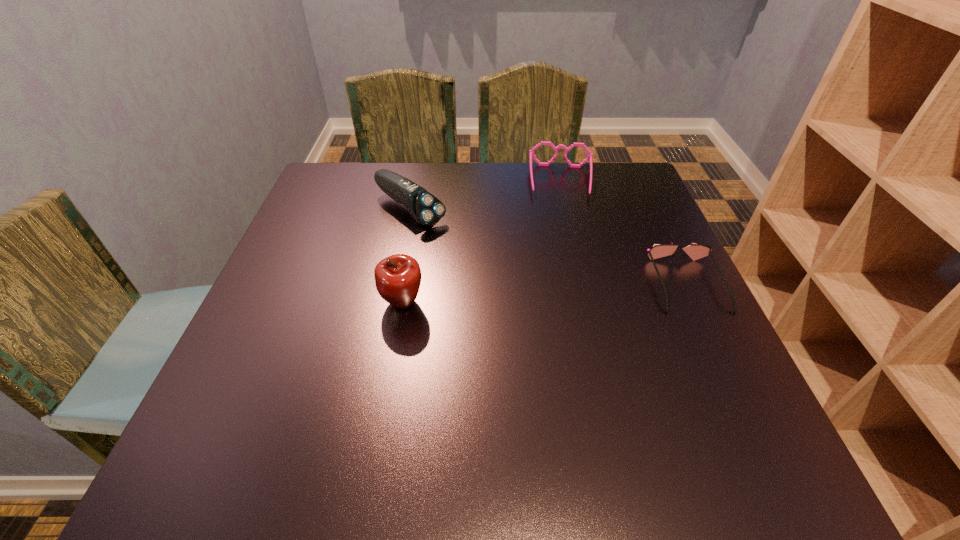
Where is `free location at the near edge of the desktop`? free location at the near edge of the desktop is located at coordinates (440, 394).

Where is `vacant region at the left edge`? The height and width of the screenshot is (540, 960). vacant region at the left edge is located at coordinates (314, 311).

At what (x,y) coordinates should I click in order to perform the action: click on vacant space at the right edge. Please return your answer as a coordinate pair (x, y). The width and height of the screenshot is (960, 540). Looking at the image, I should click on click(x=626, y=256).

This screenshot has height=540, width=960. What are the coordinates of `vacant region at the far right corner of the desktop` in the screenshot? It's located at (621, 173).

What are the coordinates of `free spot between the electric shaver and the shortest object` in the screenshot? It's located at (548, 247).

Image resolution: width=960 pixels, height=540 pixels. What are the coordinates of `free point between the sunglasses and the tallest object` in the screenshot? It's located at (544, 294).

The width and height of the screenshot is (960, 540). I want to click on vacant area between the apple and the sunglasses, so click(x=544, y=294).

Image resolution: width=960 pixels, height=540 pixels. I want to click on blank region between the shortest object and the electric shaver, so click(x=548, y=247).

Where is `vacant space in between the third object from left to right and the rightmost object`? Image resolution: width=960 pixels, height=540 pixels. vacant space in between the third object from left to right and the rightmost object is located at coordinates (625, 233).

At what (x,y) coordinates should I click in order to perform the action: click on free point between the shortest object and the electric shaver. Please return your answer as a coordinate pair (x, y). This screenshot has width=960, height=540. Looking at the image, I should click on (548, 247).